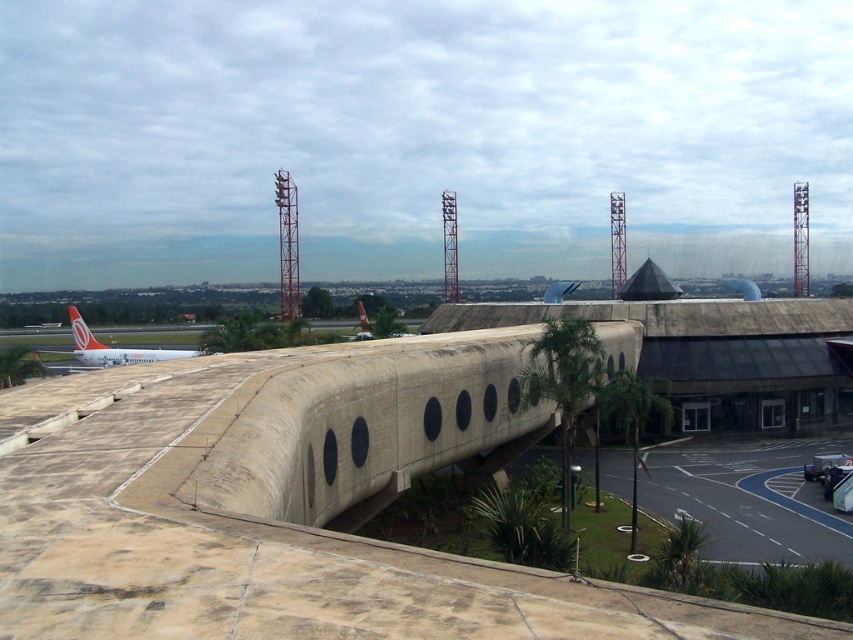
Question: Does green leafy palm tree at lower right lie in front of matte orange airplane at left?

Choices:
 (A) no
 (B) yes

Answer: (B)

Question: Which of these objects is positioned closest to the green leafy palm tree at center?

Choices:
 (A) black asphalt at lower right
 (B) matte orange airplane at left

Answer: (A)

Question: Which object is the farthest from the matte orange airplane at left?

Choices:
 (A) green leafy palm tree at lower right
 (B) green leafy palm tree at center
 (C) black asphalt at lower right

Answer: (A)

Question: Which of the following is the closest to the observer?

Choices:
 (A) matte orange airplane at left
 (B) green leafy palm tree at lower right
 (C) black asphalt at lower right

Answer: (C)

Question: Is black asphalt at lower right bigger than green leafy palm tree at center?

Choices:
 (A) no
 (B) yes

Answer: (B)

Question: Is green leafy palm tree at lower right below matte orange airplane at left?

Choices:
 (A) no
 (B) yes

Answer: (B)